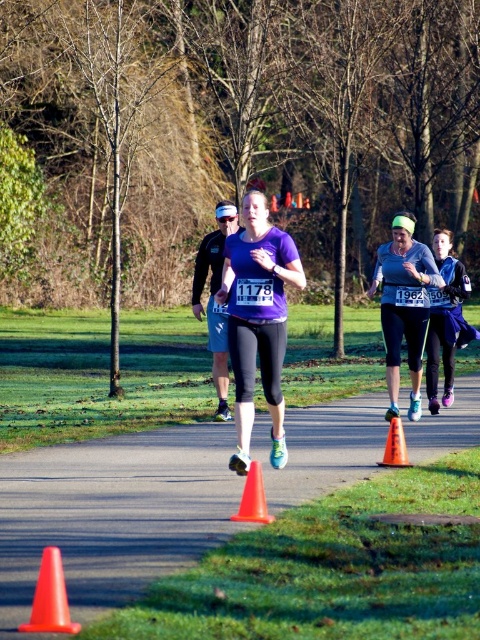
Does orange plastic cone at lower left appear under orange plastic cone at center?

Yes.

The image size is (480, 640). Find the location of `orange plastic cone at lower left`. orange plastic cone at lower left is located at coordinates (49, 596).

Where is `orange plastic cone at lower left`? Image resolution: width=480 pixels, height=640 pixels. orange plastic cone at lower left is located at coordinates (49, 596).

From the picture: Does matte black visor at center come behind orange plastic cone at lower left?

That is True.

Does matte black visor at center appear under orange plastic cone at lower left?

Incorrect, matte black visor at center is not positioned below orange plastic cone at lower left.

Is point (197, 307) positioned behind point (40, 593)?

That is True.

Identify the location of matte black visor at center. The height and width of the screenshot is (640, 480). (214, 300).

Who is more forward, [14,493] or [70,618]?

Positioned in front is point [70,618].

Image resolution: width=480 pixels, height=640 pixels. In order to click on smooth asphalt road at center in this screenshot , I will do `click(112, 515)`.

The height and width of the screenshot is (640, 480). I want to click on smooth asphalt road at center, so click(x=112, y=515).